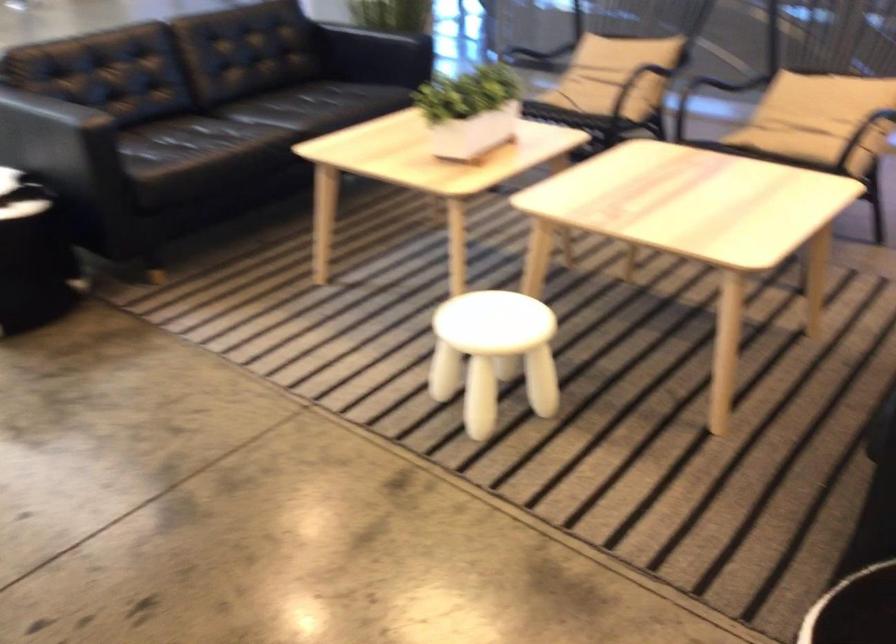
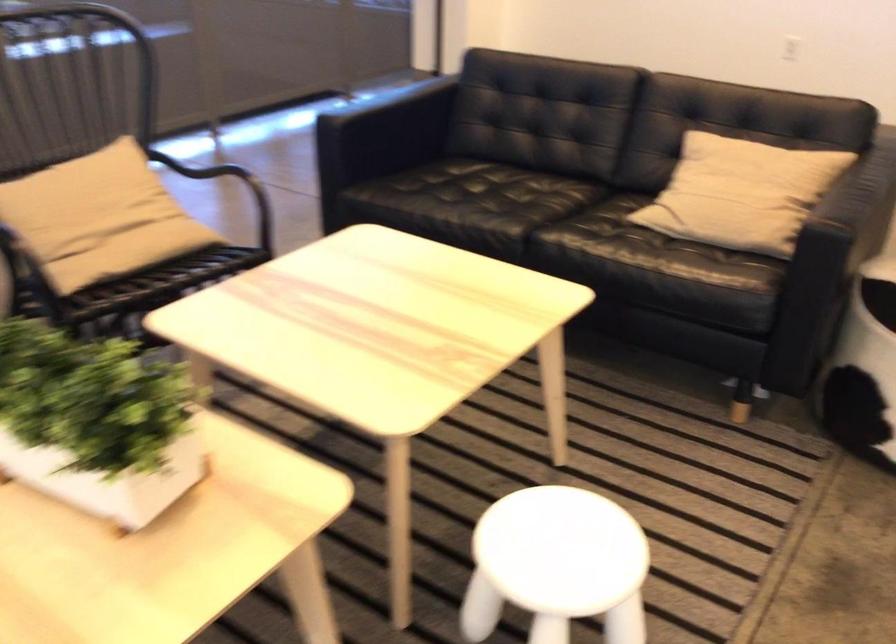
Locate, in the second image, the point that corresponds to point (488, 334) in the first image.

(556, 565)